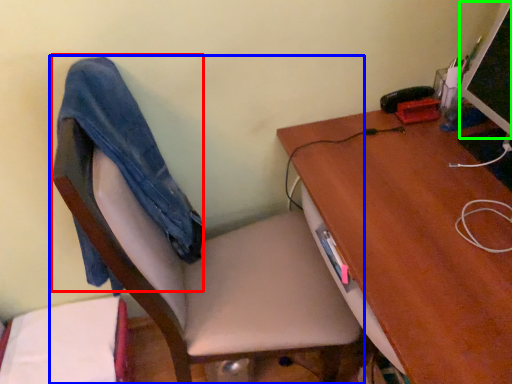
Question: Considering the real-world distances, which object is closest to jeans (highlighted by a red box)? chair (highlighted by a blue box) or computer monitor (highlighted by a green box).

Choices:
 (A) chair
 (B) computer monitor

Answer: (A)